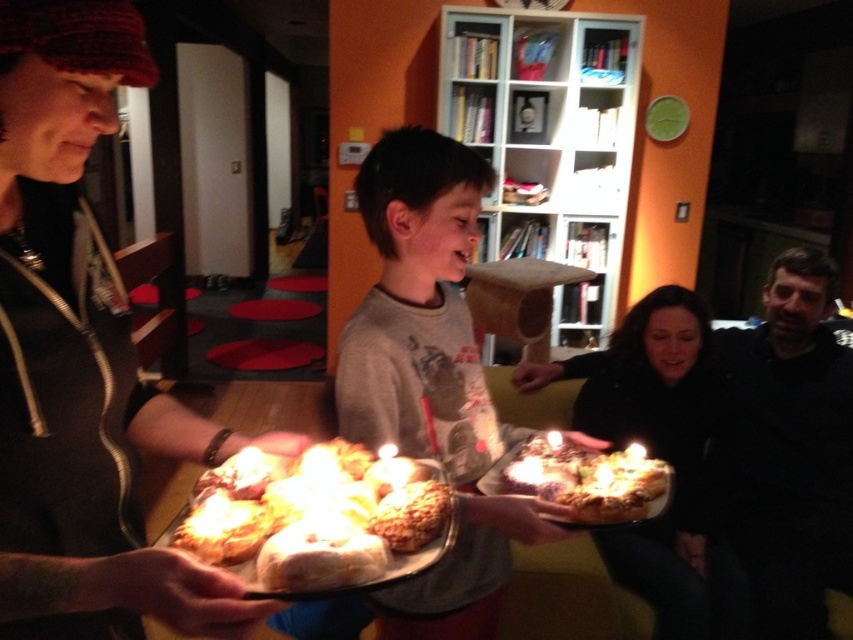
Question: Which point appears farthest from the camera in this image?

Choices:
 (A) pyautogui.click(x=631, y=556)
 (B) pyautogui.click(x=402, y=529)

Answer: (A)

Question: From the image, what is the correct spatial relationship of black matte sweater at right in relation to golden brown crusty bread at center?

Choices:
 (A) above
 (B) below

Answer: (B)

Question: Is gray cotton shirt at center to the right of golden brown cake at center from the viewer's perspective?

Choices:
 (A) yes
 (B) no

Answer: (B)

Question: Which point appears farthest from the camera in this image?

Choices:
 (A) (538, 458)
 (B) (746, 356)
 (C) (343, 499)

Answer: (B)

Question: Considering the relative positions of gray cotton shirt at center and golden brown crusty bread at center in the image provided, where is gray cotton shirt at center located with respect to golden brown crusty bread at center?

Choices:
 (A) below
 (B) above

Answer: (B)

Question: Estimate the real-world distances between objects in this image. Which object is farther from the dark gray sweater at lower right?

Choices:
 (A) golden brown cake at center
 (B) golden brown crusty bread at center
 (C) gray cotton shirt at center

Answer: (B)